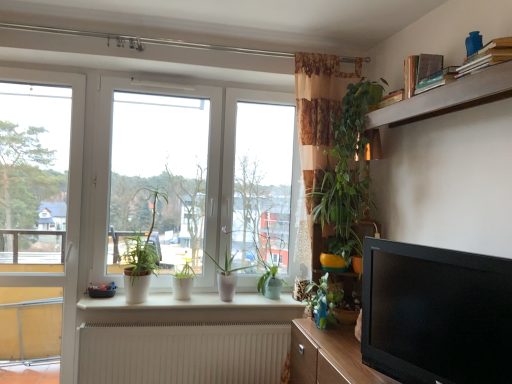
Where is `vacant area that is in front of blue glossy houseplant at lower center, which is the second houseplant from right to left`? The image size is (512, 384). vacant area that is in front of blue glossy houseplant at lower center, which is the second houseplant from right to left is located at coordinates (335, 343).